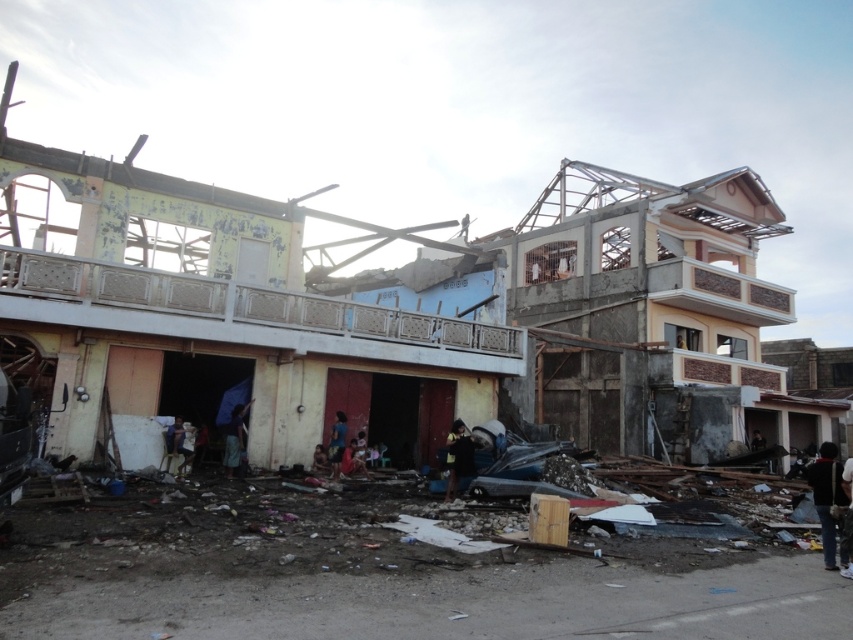
You are a rescue worker looking for survivors in the disaster area. You notice two fabrics, the blue fabric at lower center and the red fabric cloth at center. Which fabric is covering the other one?

The blue fabric at lower center is positioned over the red fabric cloth at center, so it is covering it.